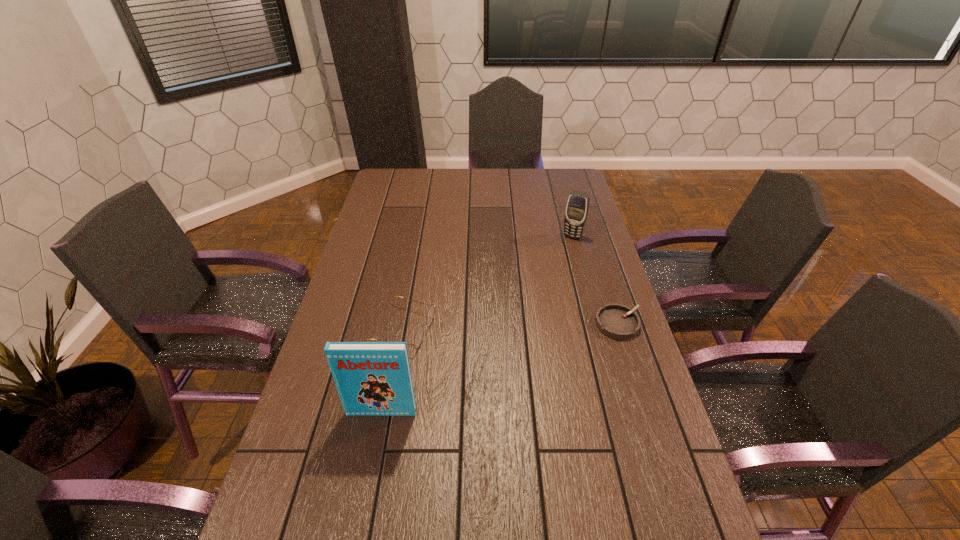
I want to click on vacant space on the desktop that is between the nearest object and the ashtray and is positioned on the temples of the third tallest object, so click(x=530, y=356).

Where is `free space on the desktop that is between the tallest object and the shortest object and is positioned on the front face of the second tallest object`? This screenshot has height=540, width=960. free space on the desktop that is between the tallest object and the shortest object and is positioned on the front face of the second tallest object is located at coordinates (499, 368).